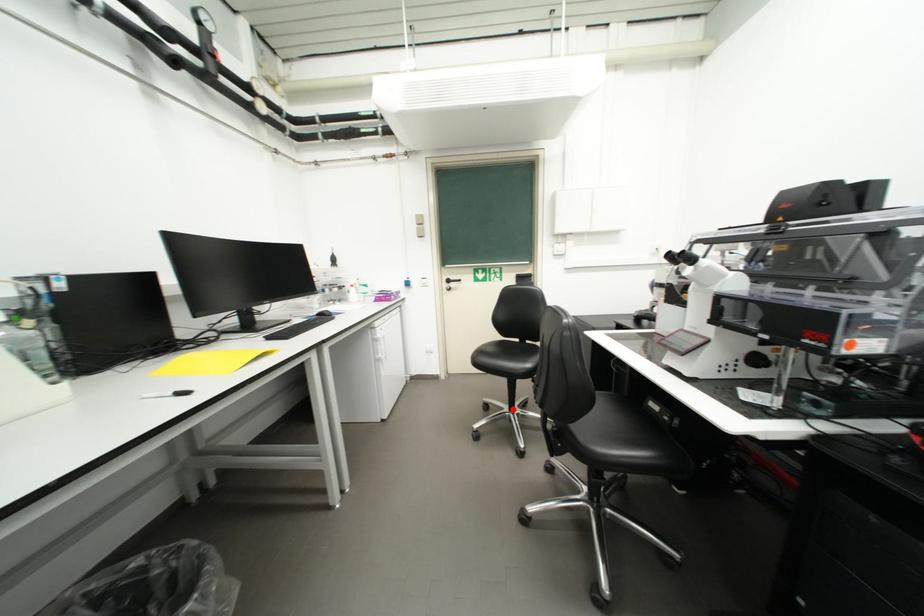
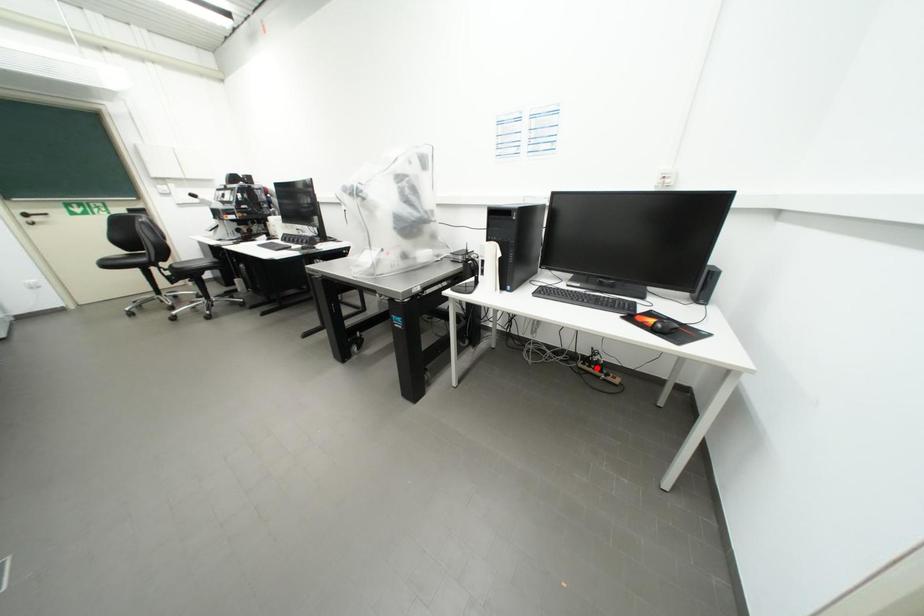
I am providing you with two images of the same scene from different viewpoints. A red point is marked on the first image and another point is marked on the second image. Are the points marked in image1 and image2 representing the same 3D position?

No